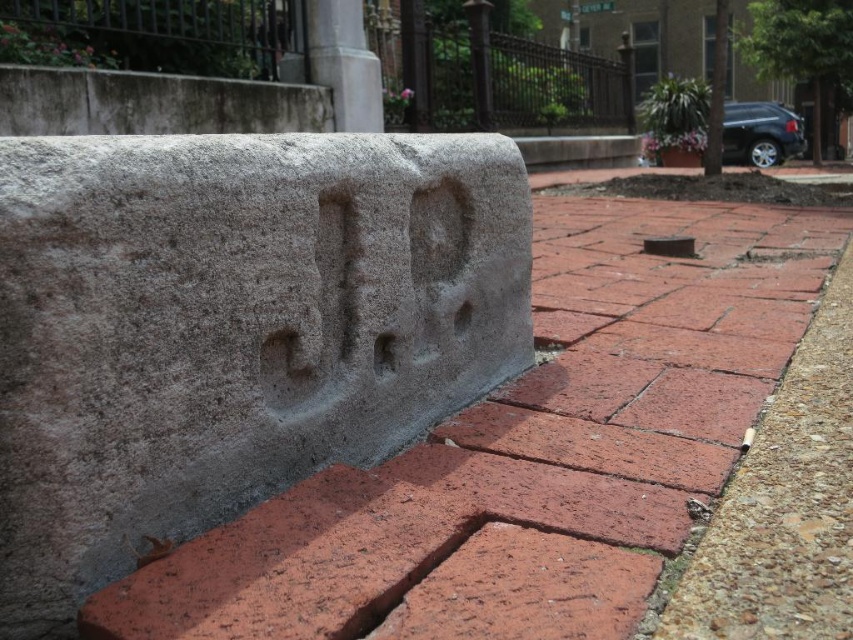
Is gray concrete at center taller than red brick pavement at lower right?

Yes, gray concrete at center is taller than red brick pavement at lower right.

Where is `gray concrete at center`? gray concrete at center is located at coordinates (231, 328).

Describe the element at coordinates (231, 328) in the screenshot. I see `gray concrete at center` at that location.

Find the location of a particular element. This screenshot has height=640, width=853. gray concrete at center is located at coordinates (231, 328).